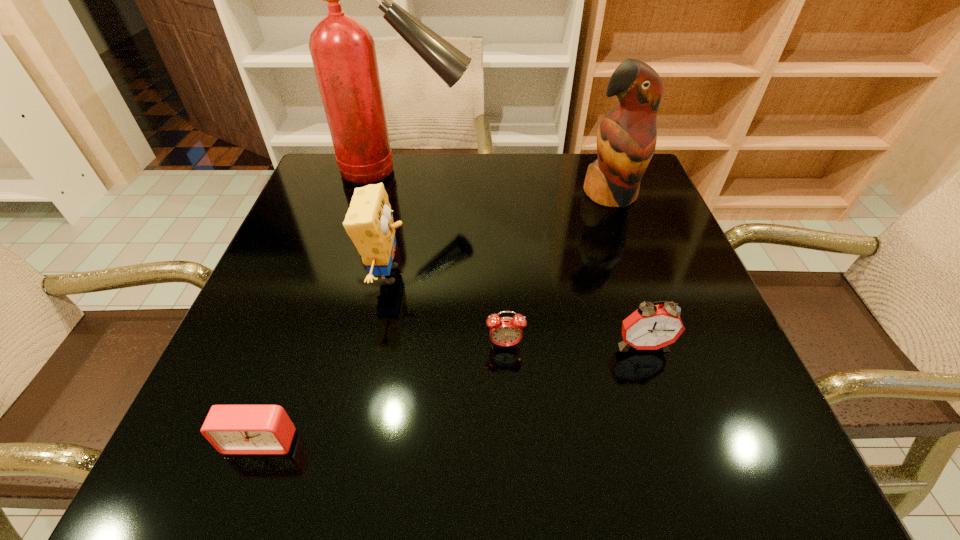
What are the coordinates of `fire extinguisher` in the screenshot? It's located at (343, 53).

Find the location of a particular element. parrot is located at coordinates (626, 138).

Identify the location of sponge. The height and width of the screenshot is (540, 960). (369, 223).

The image size is (960, 540). I want to click on the fourth shortest object, so click(x=369, y=223).

In order to click on the third shortest object in this screenshot , I will do `click(651, 327)`.

This screenshot has height=540, width=960. What are the coordinates of `the rightmost alarm clock` in the screenshot? It's located at (651, 327).

At what (x,y) coordinates should I click in order to perform the action: click on the fourth object from left to right. Please return your answer as a coordinate pair (x, y). The width and height of the screenshot is (960, 540). Looking at the image, I should click on (504, 331).

Identify the location of the leftmost alarm clock. (232, 429).

You are a GUI agent. You are given a task and a screenshot of the screen. Output one action in this format:
    pyautogui.click(x=<x>, y=<y>)
    Task: Click on the nearest alarm clock
    
    Given the screenshot: What is the action you would take?
    pyautogui.click(x=232, y=429)

This screenshot has height=540, width=960. Identify the location of free space located at the nozzle end of the fire extinguisher. coord(540,172).